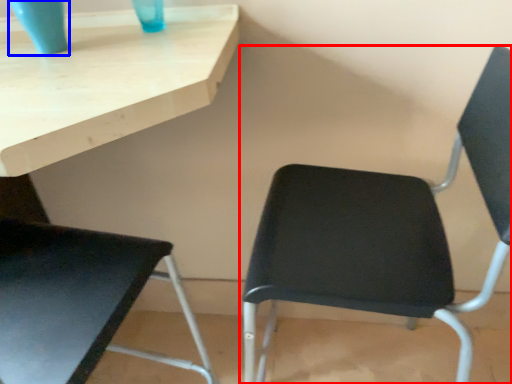
Question: Among these objects, which one is farthest to the camera, chair (highlighted by a red box) or glass vase (highlighted by a blue box)?

Choices:
 (A) chair
 (B) glass vase

Answer: (B)